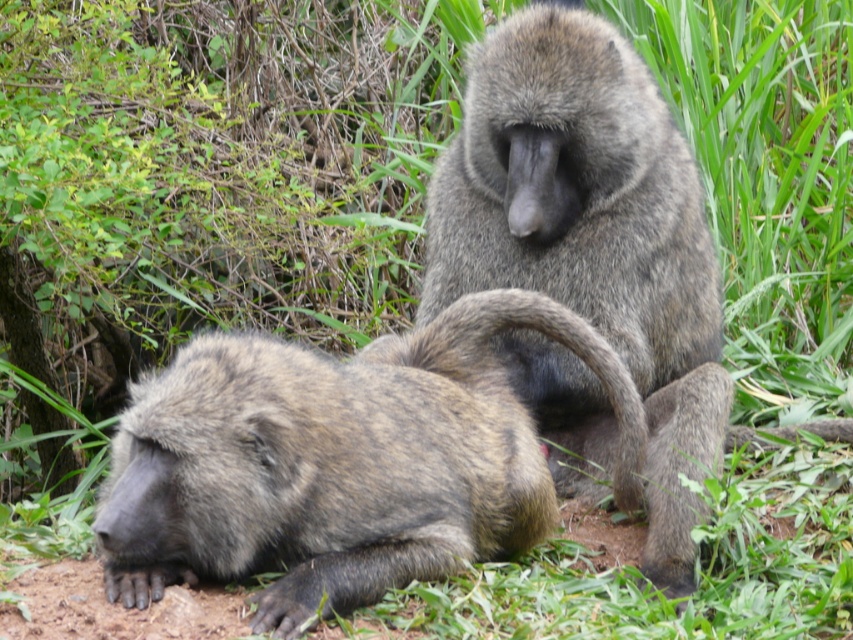
You are a wildlife photographer trying to capture a closeup shot of the brown fur monkey at lower left and the gray furry monkey at center. Since you want to focus on the larger one, which monkey should you zoom in on?

The brown fur monkey at lower left is larger in size compared to the gray furry monkey at center, so you should zoom in on the brown fur monkey at lower left to capture the closeup shot.

You are standing in the natural setting shown in the image and want to approach the brown fur monkey at lower left without disturbing it. If your comfortable distance is 10 feet, can you take one step forward from your current position?

The brown fur monkey at lower left and viewer are 9.66 feet apart from each other, which is within your comfortable distance of 10 feet. Therefore, you do not need to take a step forward.